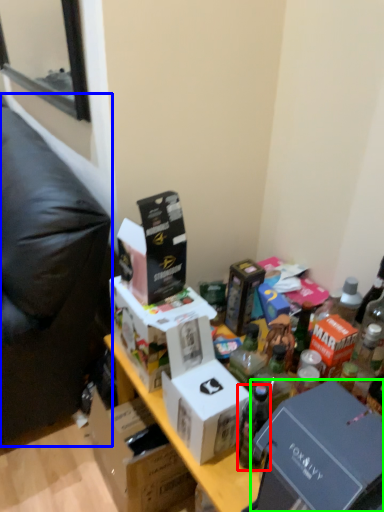
Question: Estimate the real-world distances between objects in this image. Which object is farther from bottle (highlighted by a red box), furniture (highlighted by a blue box) or box (highlighted by a green box)?

Choices:
 (A) furniture
 (B) box

Answer: (A)